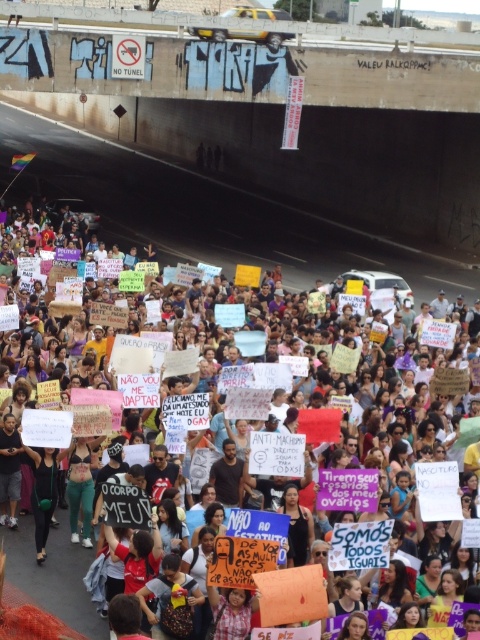
You are a protester holding a white paper sign at center. You want to make sure your sign is visible to people on the brown concrete highway at upper center. Is your sign taller than the highway?

The brown concrete highway at upper center is taller than the white paper sign at center, so the sign may not be visible to people on the highway because it is shorter than the highway structure.

You are a photographer standing at the base of the overpass and want to capture both the point at coordinates point (x=240, y=163) and point (x=15, y=548) in your photo. Which point should you focus on first to ensure both are in focus?

You should focus on point (x=240, y=163) first because it is closer to you than point (x=15, y=548). This ensures that both points will be within the depth of field.